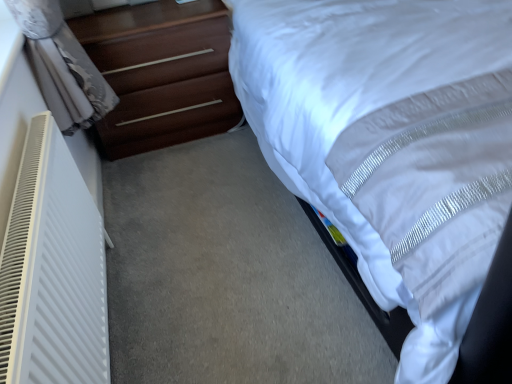
Question: Is dark brown wood chest of drawers at left completely or partially outside of white satin bed at upper right?

Choices:
 (A) yes
 (B) no

Answer: (A)

Question: Considering the relative positions of dark brown wood chest of drawers at left and white satin bed at upper right in the image provided, is dark brown wood chest of drawers at left to the left of white satin bed at upper right from the viewer's perspective?

Choices:
 (A) yes
 (B) no

Answer: (A)

Question: From a real-world perspective, is dark brown wood chest of drawers at left positioned under white satin bed at upper right based on gravity?

Choices:
 (A) yes
 (B) no

Answer: (A)

Question: Is dark brown wood chest of drawers at left at the right side of white satin bed at upper right?

Choices:
 (A) no
 (B) yes

Answer: (A)

Question: From the image's perspective, is dark brown wood chest of drawers at left on white satin bed at upper right?

Choices:
 (A) yes
 (B) no

Answer: (B)

Question: From the image's perspective, is white satin bed at upper right located above or below white plastic radiator at left?

Choices:
 (A) below
 (B) above

Answer: (B)

Question: Visually, is white satin bed at upper right positioned to the left or to the right of white plastic radiator at left?

Choices:
 (A) right
 (B) left

Answer: (A)

Question: From a real-world perspective, is white satin bed at upper right above or below white plastic radiator at left?

Choices:
 (A) below
 (B) above

Answer: (B)

Question: Based on their sizes in the image, would you say white satin bed at upper right is bigger or smaller than white plastic radiator at left?

Choices:
 (A) small
 (B) big

Answer: (B)

Question: From the image's perspective, relative to white satin bed at upper right, is white plastic radiator at left above or below?

Choices:
 (A) above
 (B) below

Answer: (B)

Question: Is white plastic radiator at left wider or thinner than white satin bed at upper right?

Choices:
 (A) wide
 (B) thin

Answer: (B)

Question: Looking at the image, does white plastic radiator at left seem bigger or smaller compared to white satin bed at upper right?

Choices:
 (A) small
 (B) big

Answer: (A)

Question: From a real-world perspective, is white plastic radiator at left physically located above or below white satin bed at upper right?

Choices:
 (A) above
 (B) below

Answer: (B)

Question: Which is correct: white satin bed at upper right is inside dark brown wood chest of drawers at left, or outside of it?

Choices:
 (A) inside
 (B) outside

Answer: (B)

Question: Is white satin bed at upper right wider or thinner than dark brown wood chest of drawers at left?

Choices:
 (A) thin
 (B) wide

Answer: (B)